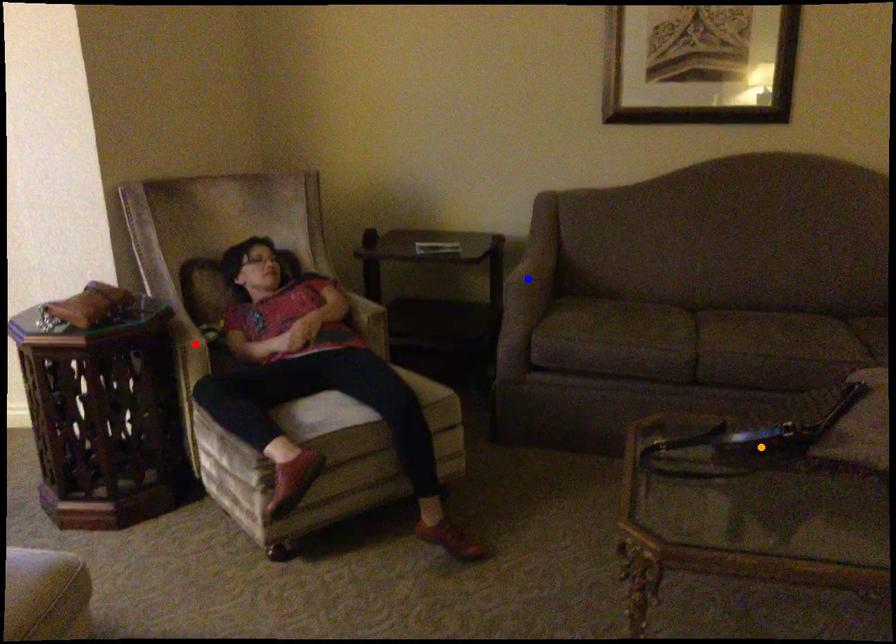
Order these from nearest to farthest:
red point, orange point, blue point

orange point → red point → blue point